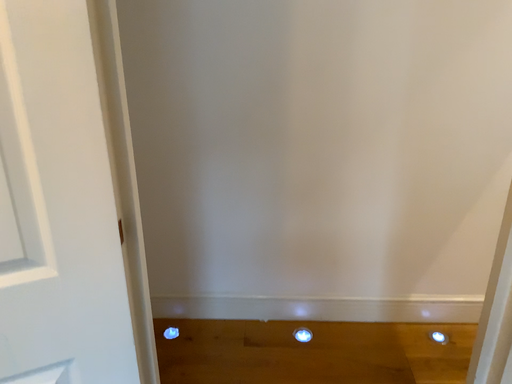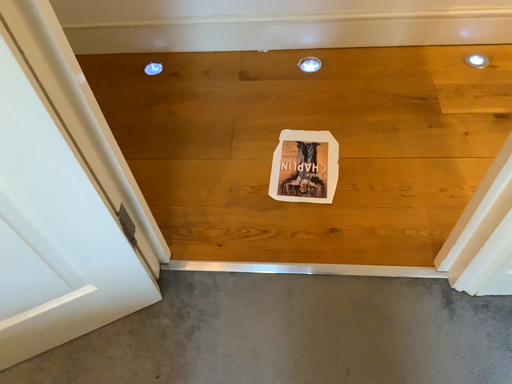
Question: How did the camera likely rotate when shooting the video?

Choices:
 (A) rotated upward
 (B) rotated downward

Answer: (B)